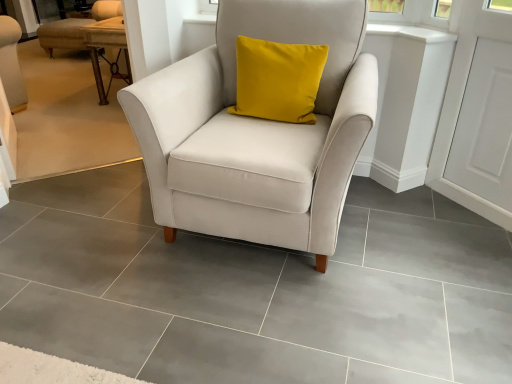
Question: Looking at their shapes, would you say satin white armchair at center is wider or thinner than white smooth window sill at upper center?

Choices:
 (A) wide
 (B) thin

Answer: (A)

Question: From the image's perspective, relative to white smooth window sill at upper center, is satin white armchair at center above or below?

Choices:
 (A) above
 (B) below

Answer: (B)

Question: Which is nearer to the wooden textured table at upper left?

Choices:
 (A) white smooth window sill at upper center
 (B) satin white armchair at center

Answer: (B)

Question: Estimate the real-world distances between objects in this image. Which object is farther from the white smooth window sill at upper center?

Choices:
 (A) satin white armchair at center
 (B) wooden textured table at upper left

Answer: (B)